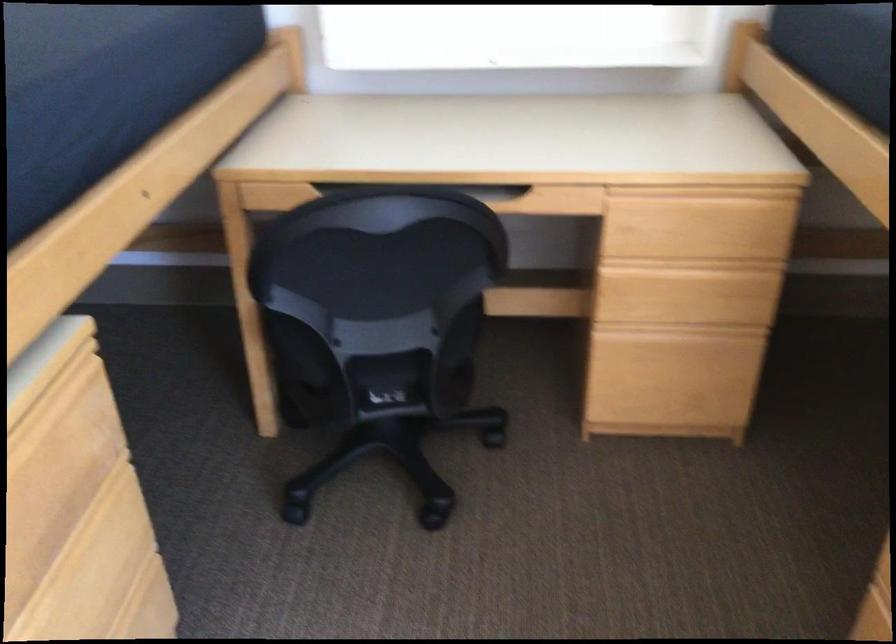
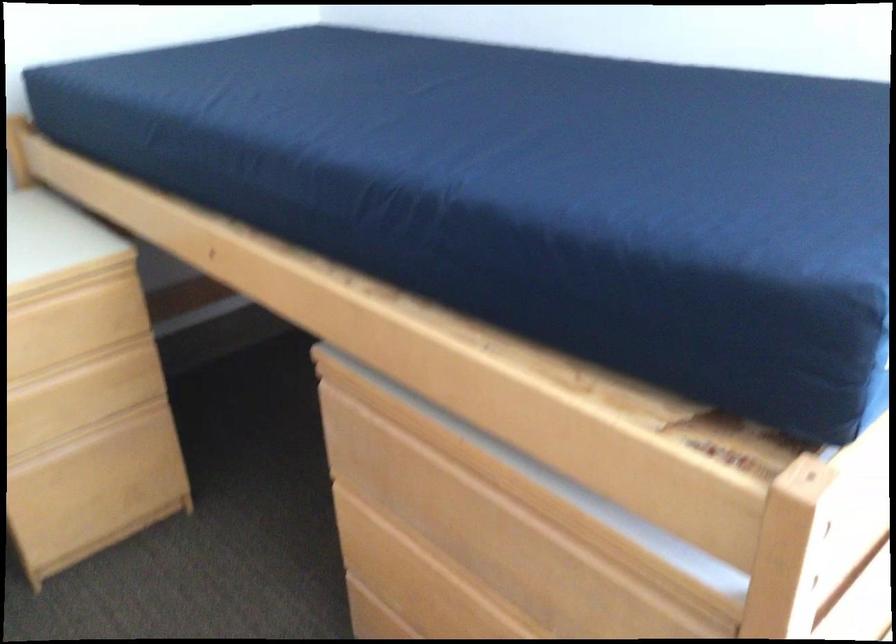
In the second image, find the point that corresponds to (x=659, y=386) in the first image.

(97, 495)